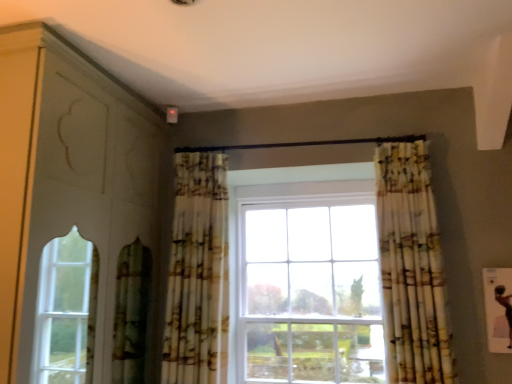
Identify the location of printed fabric curtain at right, marked as the second curtain in a left-to-right arrangement. (411, 267).

What is the approximate width of matte white dresser at left?

It is 27.21 inches.

Image resolution: width=512 pixels, height=384 pixels. I want to click on printed fabric curtain at center, placed as the first curtain when sorted from left to right, so click(x=198, y=272).

How different are the orientations of printed fabric curtain at center, which is the 2th curtain from right to left, and matte white dresser at left in degrees?

The facing directions of printed fabric curtain at center, which is the 2th curtain from right to left, and matte white dresser at left are 89.6 degrees apart.

Between point (177, 249) and point (106, 364), which one is positioned in front?

Point (106, 364)

Considering the positions of objects printed fabric curtain at center, placed as the first curtain when sorted from left to right, and matte white dresser at left in the image provided, who is more to the right, printed fabric curtain at center, placed as the first curtain when sorted from left to right, or matte white dresser at left?

printed fabric curtain at center, placed as the first curtain when sorted from left to right, is more to the right.

Which object is closer to the camera, printed fabric curtain at center, placed as the first curtain when sorted from left to right, or matte white dresser at left?

matte white dresser at left is more forward.

Is printed fabric curtain at center, which is the 2th curtain from right to left, taller than printed fabric curtain at right, placed as the 1th curtain when sorted from right to left?

Yes, printed fabric curtain at center, which is the 2th curtain from right to left, is taller than printed fabric curtain at right, placed as the 1th curtain when sorted from right to left.

Are printed fabric curtain at center, placed as the first curtain when sorted from left to right, and printed fabric curtain at right, placed as the 1th curtain when sorted from right to left, making contact?

printed fabric curtain at center, placed as the first curtain when sorted from left to right, is not next to printed fabric curtain at right, placed as the 1th curtain when sorted from right to left, and they're not touching.

Which of these two, printed fabric curtain at center, placed as the first curtain when sorted from left to right, or printed fabric curtain at right, placed as the 1th curtain when sorted from right to left, is smaller?

printed fabric curtain at right, placed as the 1th curtain when sorted from right to left, is smaller.

From a real-world perspective, is matte white dresser at left over printed fabric curtain at center, placed as the first curtain when sorted from left to right?

Yes.

Consider the image. Is matte white dresser at left not close to printed fabric curtain at center, which is the 2th curtain from right to left?

No, there isn't a large distance between matte white dresser at left and printed fabric curtain at center, which is the 2th curtain from right to left.

Which object is wider, matte white dresser at left or printed fabric curtain at center, which is the 2th curtain from right to left?

matte white dresser at left.

Considering the positions of objects printed fabric curtain at right, marked as the second curtain in a left-to-right arrangement, and matte white dresser at left in the image provided, who is more to the left, printed fabric curtain at right, marked as the second curtain in a left-to-right arrangement, or matte white dresser at left?

matte white dresser at left is more to the left.

Is matte white dresser at left surrounded by printed fabric curtain at right, placed as the 1th curtain when sorted from right to left?

No.

Considering the sizes of objects printed fabric curtain at right, placed as the 1th curtain when sorted from right to left, and matte white dresser at left in the image provided, who is thinner, printed fabric curtain at right, placed as the 1th curtain when sorted from right to left, or matte white dresser at left?

With smaller width is printed fabric curtain at right, placed as the 1th curtain when sorted from right to left.

Does point (397, 371) appear closer or farther from the camera than point (33, 212)?

Point (397, 371) is positioned farther from the camera compared to point (33, 212).

Does matte white dresser at left turn towards printed fabric curtain at right, placed as the 1th curtain when sorted from right to left?

Yes, matte white dresser at left is oriented towards printed fabric curtain at right, placed as the 1th curtain when sorted from right to left.

Which is closer, (84, 57) or (442, 276)?

Clearly, point (84, 57) is closer to the camera than point (442, 276).

Can you tell me how much matte white dresser at left and printed fabric curtain at right, marked as the second curtain in a left-to-right arrangement, differ in facing direction?

The angle between the facing direction of matte white dresser at left and the facing direction of printed fabric curtain at right, marked as the second curtain in a left-to-right arrangement, is 94.1 degrees.

Is matte white dresser at left positioned behind printed fabric curtain at right, placed as the 1th curtain when sorted from right to left?

No, matte white dresser at left is closer to the viewer.

Where is `curtain located above the printed fabric curtain at center, which is the 2th curtain from right to left (from the image's perspective)`? curtain located above the printed fabric curtain at center, which is the 2th curtain from right to left (from the image's perspective) is located at coordinates (411, 267).

Between printed fabric curtain at right, marked as the second curtain in a left-to-right arrangement, and printed fabric curtain at center, which is the 2th curtain from right to left, which one is positioned in front?

printed fabric curtain at right, marked as the second curtain in a left-to-right arrangement, is closer to the camera.

From the image's perspective, between printed fabric curtain at right, marked as the second curtain in a left-to-right arrangement, and printed fabric curtain at center, placed as the first curtain when sorted from left to right, who is located below?

printed fabric curtain at center, placed as the first curtain when sorted from left to right, from the image's perspective.

Is printed fabric curtain at right, placed as the 1th curtain when sorted from right to left, shorter than printed fabric curtain at center, which is the 2th curtain from right to left?

Indeed, printed fabric curtain at right, placed as the 1th curtain when sorted from right to left, has a lesser height compared to printed fabric curtain at center, which is the 2th curtain from right to left.

The image size is (512, 384). Find the location of `dresser above the printed fabric curtain at center, which is the 2th curtain from right to left (from the image's perspective)`. dresser above the printed fabric curtain at center, which is the 2th curtain from right to left (from the image's perspective) is located at coordinates (68, 178).

At what (x,y) coordinates should I click in order to perform the action: click on curtain behind the printed fabric curtain at right, marked as the second curtain in a left-to-right arrangement. Please return your answer as a coordinate pair (x, y). Image resolution: width=512 pixels, height=384 pixels. Looking at the image, I should click on (198, 272).

Considering their positions, is printed fabric curtain at right, marked as the second curtain in a left-to-right arrangement, positioned closer to printed fabric curtain at center, placed as the first curtain when sorted from left to right, than matte white dresser at left?

matte white dresser at left.

Which object lies further to the anchor point matte white dresser at left, printed fabric curtain at right, marked as the second curtain in a left-to-right arrangement, or printed fabric curtain at center, which is the 2th curtain from right to left?

printed fabric curtain at right, marked as the second curtain in a left-to-right arrangement.

From the image, which object appears to be farther from printed fabric curtain at right, marked as the second curtain in a left-to-right arrangement, printed fabric curtain at center, placed as the first curtain when sorted from left to right, or matte white dresser at left?

matte white dresser at left.

Based on their spatial positions, is printed fabric curtain at center, which is the 2th curtain from right to left, or printed fabric curtain at right, placed as the 1th curtain when sorted from right to left, further from matte white dresser at left?

Among the two, printed fabric curtain at right, placed as the 1th curtain when sorted from right to left, is located further to matte white dresser at left.

Which object lies nearer to the anchor point printed fabric curtain at right, marked as the second curtain in a left-to-right arrangement, matte white dresser at left or printed fabric curtain at center, which is the 2th curtain from right to left?

Based on the image, printed fabric curtain at center, which is the 2th curtain from right to left, appears to be nearer to printed fabric curtain at right, marked as the second curtain in a left-to-right arrangement.

Which object lies further to the anchor point printed fabric curtain at center, placed as the first curtain when sorted from left to right, matte white dresser at left or printed fabric curtain at right, marked as the second curtain in a left-to-right arrangement?

Based on the image, printed fabric curtain at right, marked as the second curtain in a left-to-right arrangement, appears to be further to printed fabric curtain at center, placed as the first curtain when sorted from left to right.

This screenshot has height=384, width=512. Find the location of `curtain between matte white dresser at left and printed fabric curtain at right, placed as the 1th curtain when sorted from right to left, in the horizontal direction`. curtain between matte white dresser at left and printed fabric curtain at right, placed as the 1th curtain when sorted from right to left, in the horizontal direction is located at coordinates (198, 272).